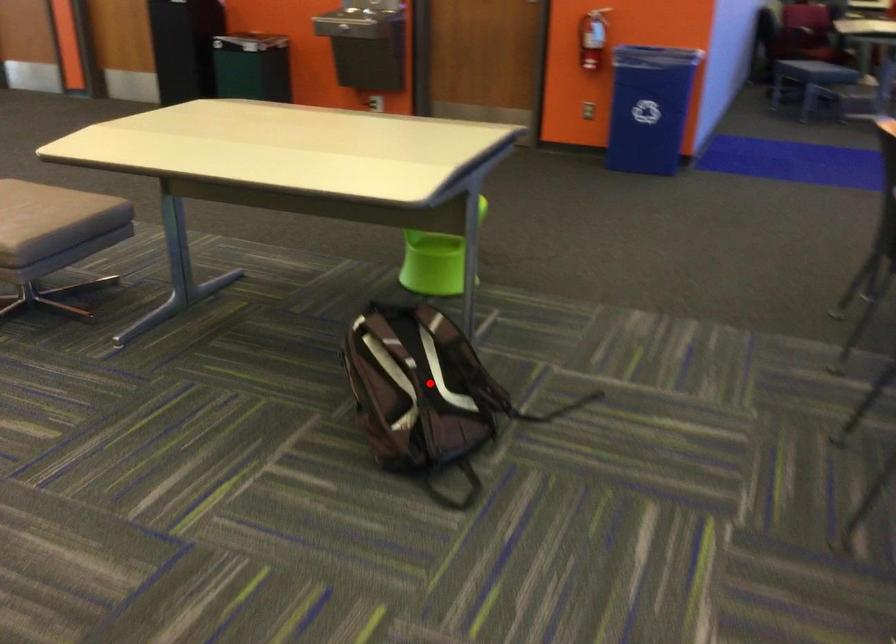
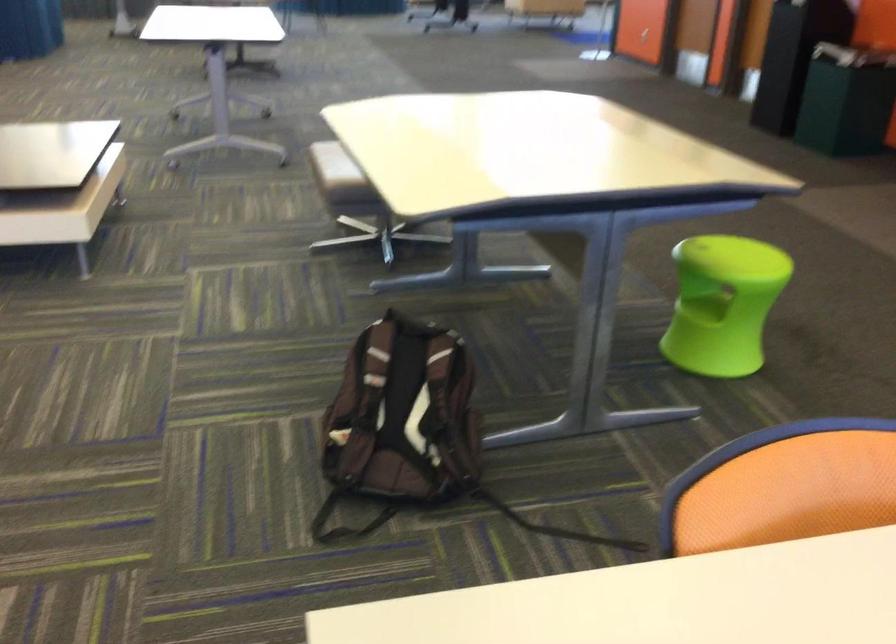
In the second image, find the point that corresponds to the highlighted location in the first image.

(402, 413)